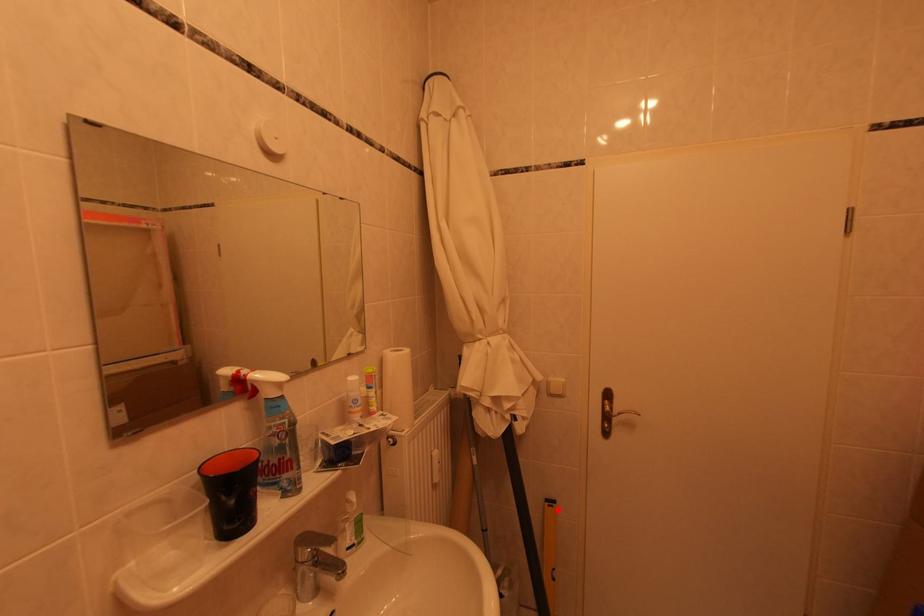
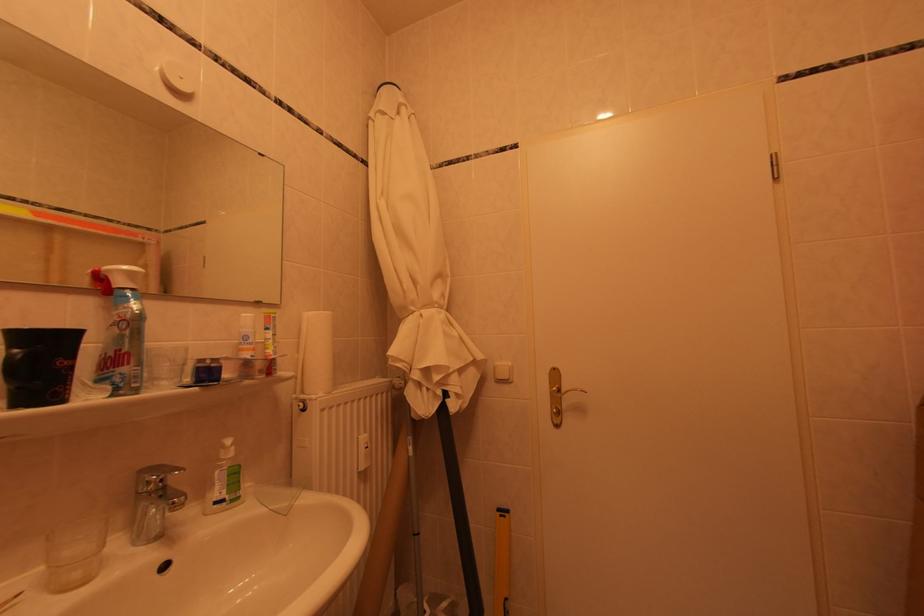
In the second image, find the point that corresponds to the highlighted location in the first image.

(509, 519)